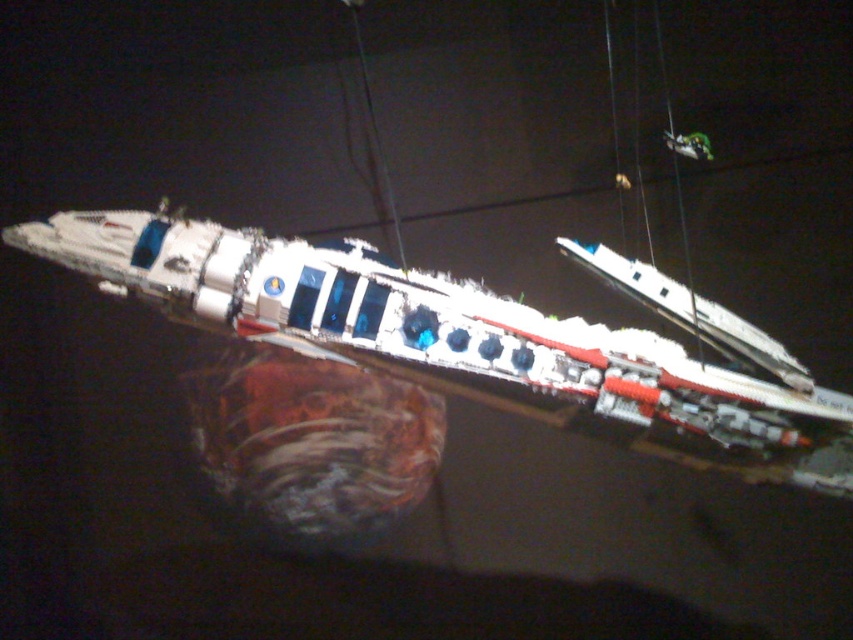
Does white plastic boat at center appear under green plastic toy at upper right?

Indeed, white plastic boat at center is positioned under green plastic toy at upper right.

Can you confirm if white plastic boat at center is wider than green plastic toy at upper right?

Correct, the width of white plastic boat at center exceeds that of green plastic toy at upper right.

Who is more forward, (347, 323) or (703, 157)?

Point (347, 323)

Image resolution: width=853 pixels, height=640 pixels. I want to click on white plastic boat at center, so click(x=476, y=339).